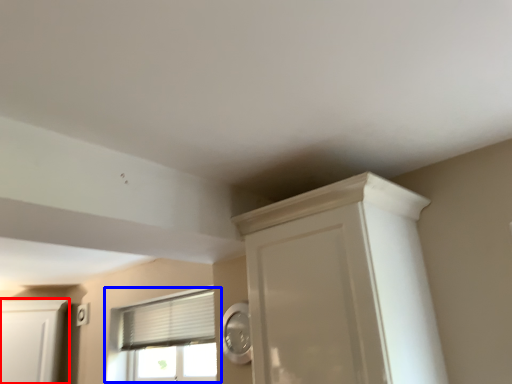
Question: Which object appears farthest to the camera in this image, cabinetry (highlighted by a red box) or window (highlighted by a blue box)?

Choices:
 (A) cabinetry
 (B) window

Answer: (A)